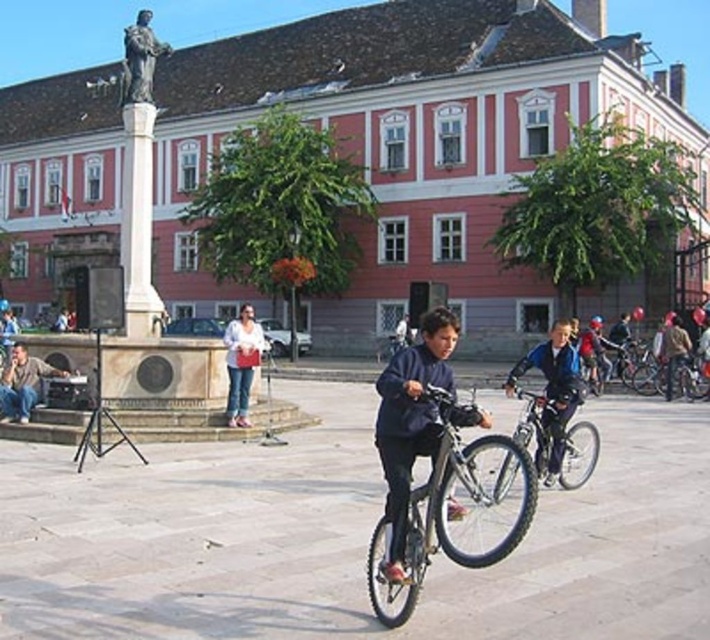
You are standing in the public square facing the historic building. You notice two points marked in the scene. The first point is at coordinate (393, 572) and the second is at (595, 355). Which point is closer to your current position?

Point (393, 572) is closer to the camera than point (595, 355), so the first point is closer to your position.

You are a photographer standing in the public square. You notice two jackets in the scene. The first is a dark blue jacket at center, and the second is a denim jacket at center. Which jacket is positioned lower in the image?

The dark blue jacket at center is positioned lower than the denim jacket at center, so the dark blue jacket at center is below the denim jacket at center.